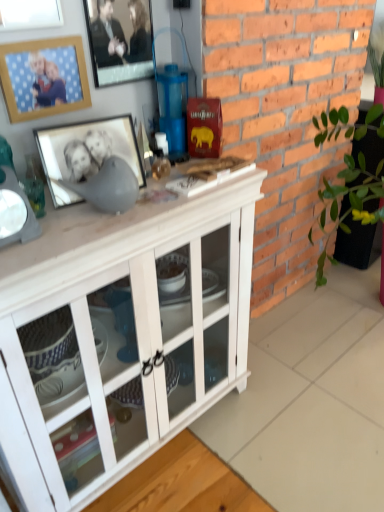
The height and width of the screenshot is (512, 384). In order to click on vacant area to the right of matte black picture frame at upper left, which is the 3th picture frame from top to bottom in this screenshot , I will do `click(161, 196)`.